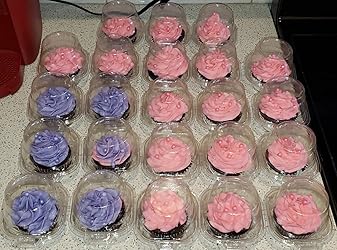
The height and width of the screenshot is (250, 337). Find the location of `red coffee maker`. red coffee maker is located at coordinates [x=22, y=22].